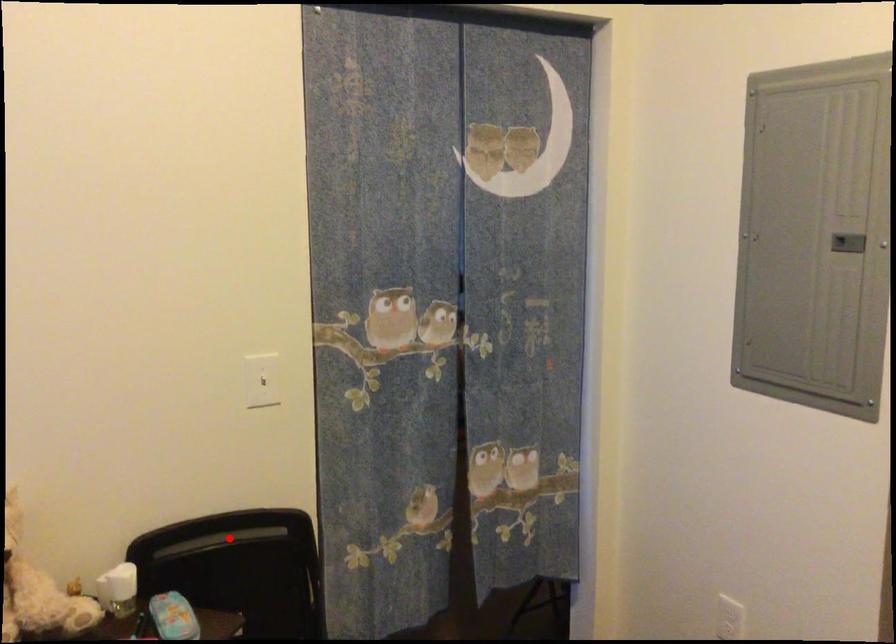
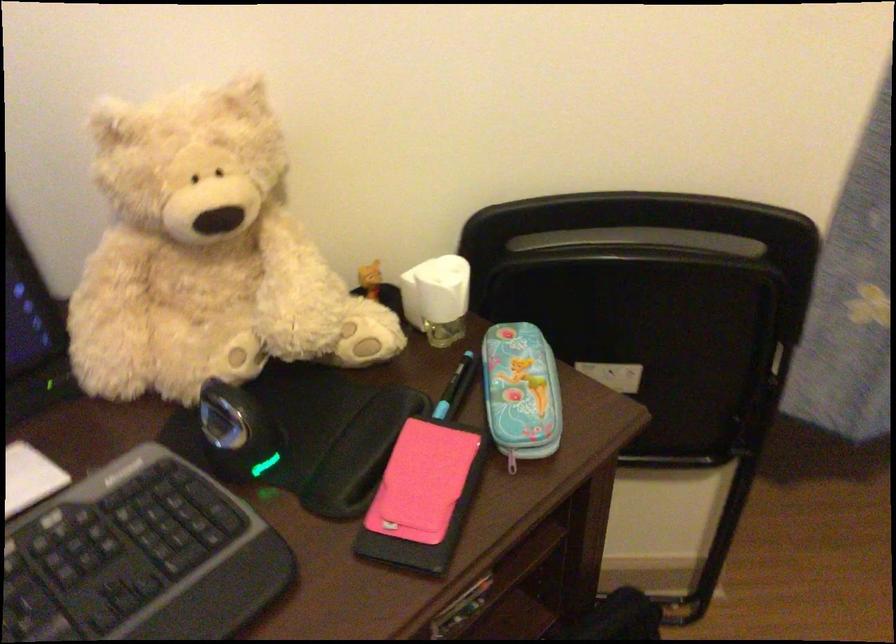
Question: I am providing you with two images of the same scene from different viewpoints. Image1 has a red point marked. In image2, the corresponding 3D location appears at what relative position? Reply with the corresponding letter.

Choices:
 (A) Closer
 (B) Farther

Answer: (A)